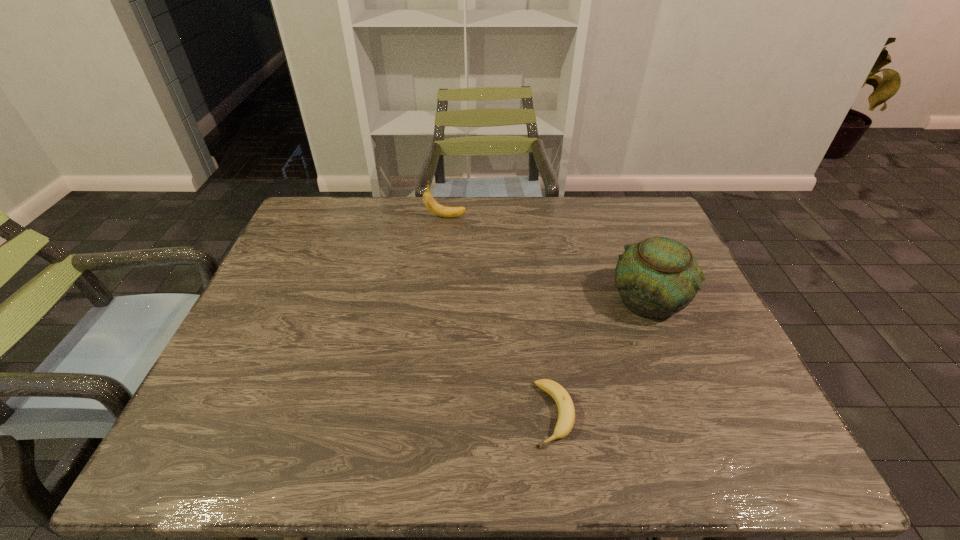
Locate an element on the screen. the second farthest object is located at coordinates (658, 277).

Identify the location of pottery. (658, 277).

Where is `the taller banana`? the taller banana is located at coordinates (440, 210).

Identify the location of the left banana. (440, 210).

Where is `the right banana`? The image size is (960, 540). the right banana is located at coordinates (566, 413).

Locate an element on the screen. This screenshot has height=540, width=960. the shorter banana is located at coordinates (566, 413).

Locate an element on the screen. free region located 0.310m on the front of the second farthest object is located at coordinates (709, 451).

Identify the location of vacant area located 0.310m at the start of the peel on the second tallest object. (563, 217).

In order to click on object positioned at the far edge in this screenshot , I will do `click(440, 210)`.

Locate an element on the screen. object located in the near edge section of the desktop is located at coordinates (566, 413).